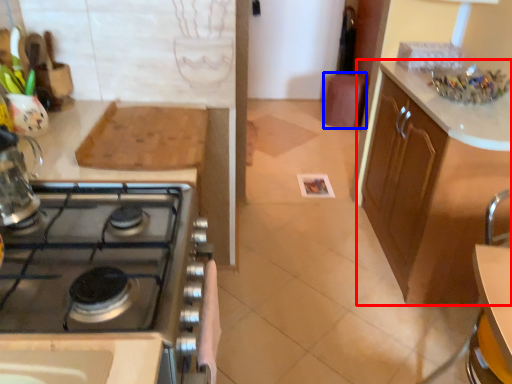
Question: Which object appears closest to the camera in this image, cabinetry (highlighted by a red box) or bar stool (highlighted by a blue box)?

Choices:
 (A) cabinetry
 (B) bar stool

Answer: (A)